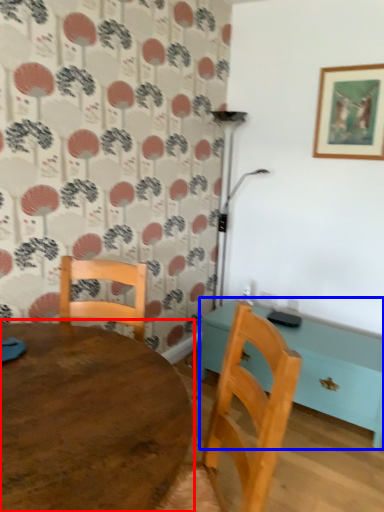
Question: Which point is closer to the camera, table (highlighted by a red box) or table (highlighted by a blue box)?

Choices:
 (A) table
 (B) table

Answer: (A)